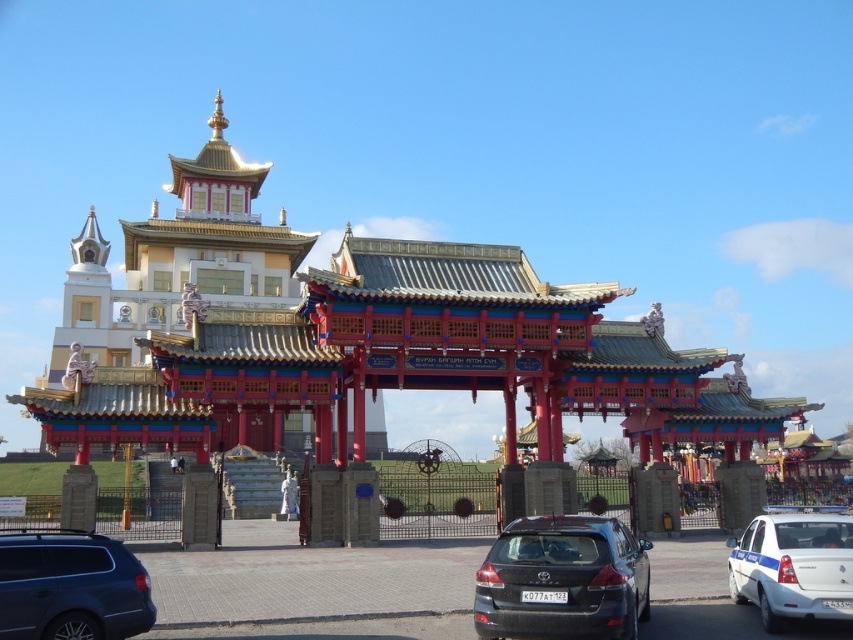
Question: Can you confirm if gold/polished metal palace at center is positioned below white glossy police car at lower right?

Choices:
 (A) yes
 (B) no

Answer: (B)

Question: Based on their relative distances, which object is nearer to the metallic gray suv at lower left?

Choices:
 (A) gold/polished metal palace at center
 (B) white glossy police car at lower right

Answer: (B)

Question: Which object is farther from the camera taking this photo?

Choices:
 (A) white glossy police car at lower right
 (B) metallic gray suv at lower left
 (C) gold/polished metal palace at center

Answer: (C)

Question: Does gold/polished metal palace at center lie in front of metallic gray suv at lower left?

Choices:
 (A) yes
 (B) no

Answer: (B)

Question: Considering the real-world distances, which object is farthest from the white glossy police car at lower right?

Choices:
 (A) metallic gray suv at lower left
 (B) gold/polished metal palace at center
 (C) matte black car at center

Answer: (B)

Question: Is matte black car at center below white glossy police car at lower right?

Choices:
 (A) no
 (B) yes

Answer: (B)